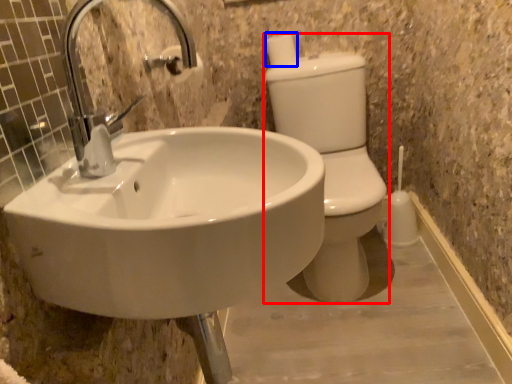
Question: Among these objects, which one is farthest to the camera, toilet bowl (highlighted by a red box) or toilet paper (highlighted by a blue box)?

Choices:
 (A) toilet bowl
 (B) toilet paper

Answer: (B)